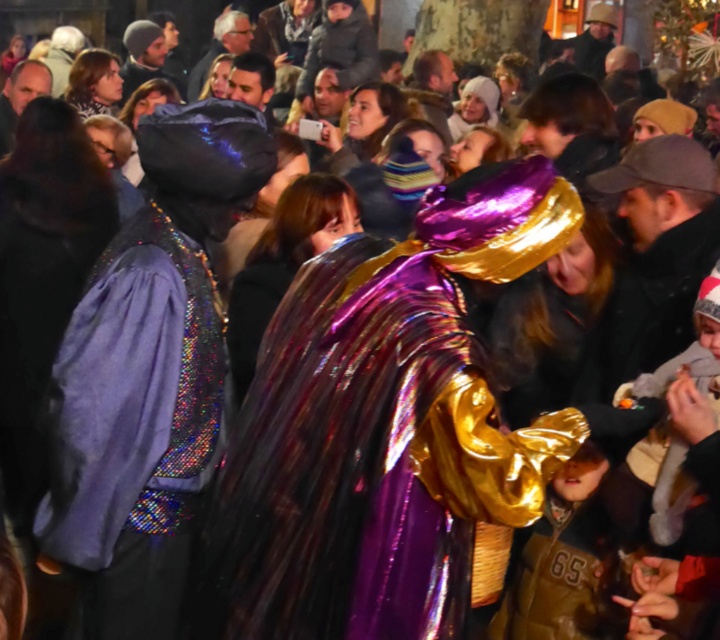
You are standing in the crowd watching the festive event. There are two points marked in the image. One is at coordinates point (x=251, y=576) and the other is at point (x=216, y=385). Which point is nearer to you?

Point (x=251, y=576) is closer to the viewer than point (x=216, y=385).

Consider the image. You are a photographer at the event and want to capture both the metallic purple cape at center and the shiny purple cape at center in a single shot. Which direction should you move to ensure both are visible in your frame?

To include both the metallic purple cape at center and the shiny purple cape at center in your frame, move to the left since the metallic purple cape at center is positioned to the right of the shiny purple cape at center.